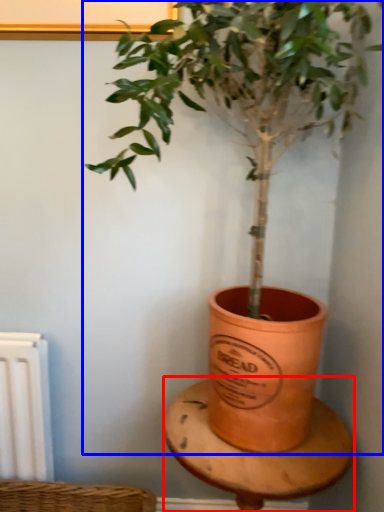
Question: Among these objects, which one is nearest to the camera, table (highlighted by a red box) or houseplant (highlighted by a blue box)?

Choices:
 (A) table
 (B) houseplant

Answer: (B)